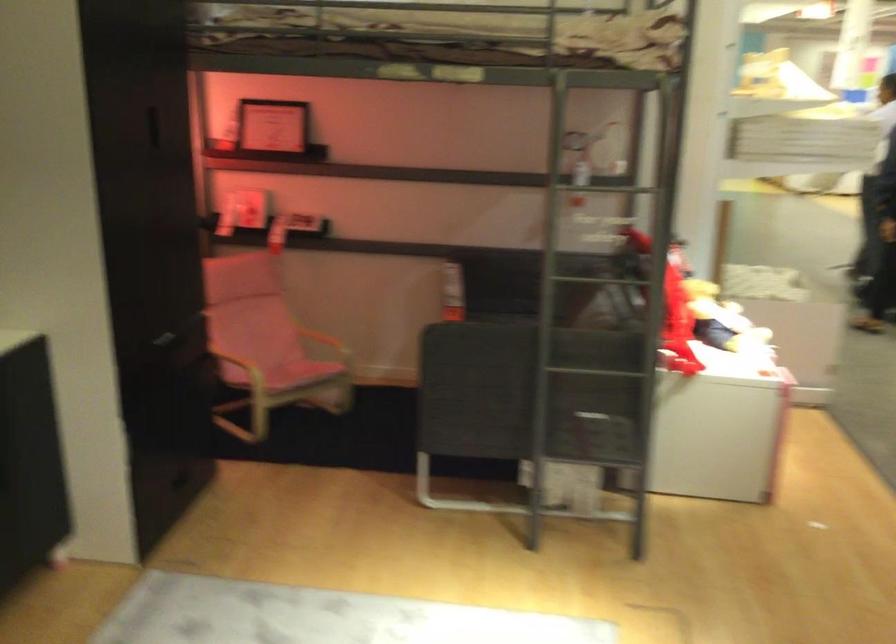
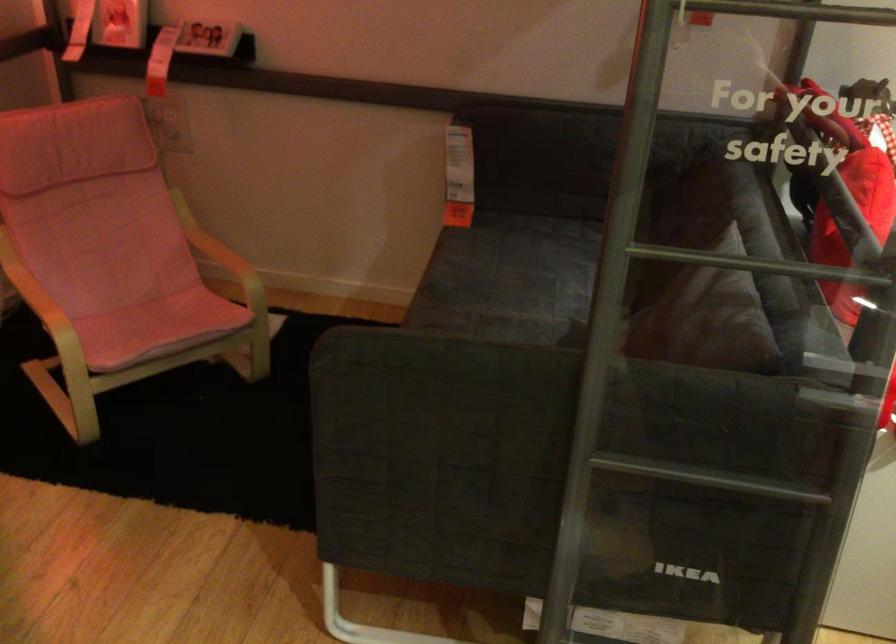
Find the pixel in the second image that matches (618,281) in the first image.

(760, 263)